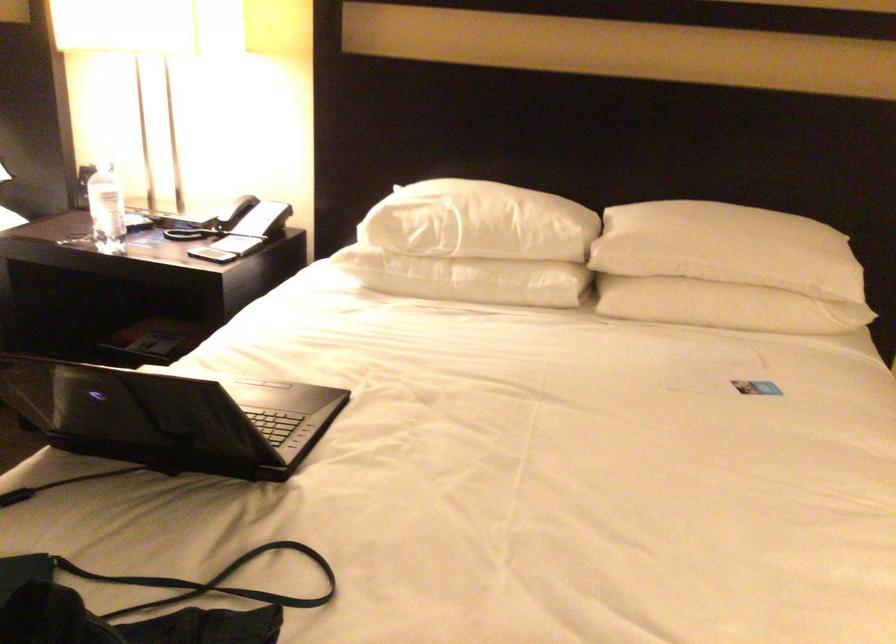
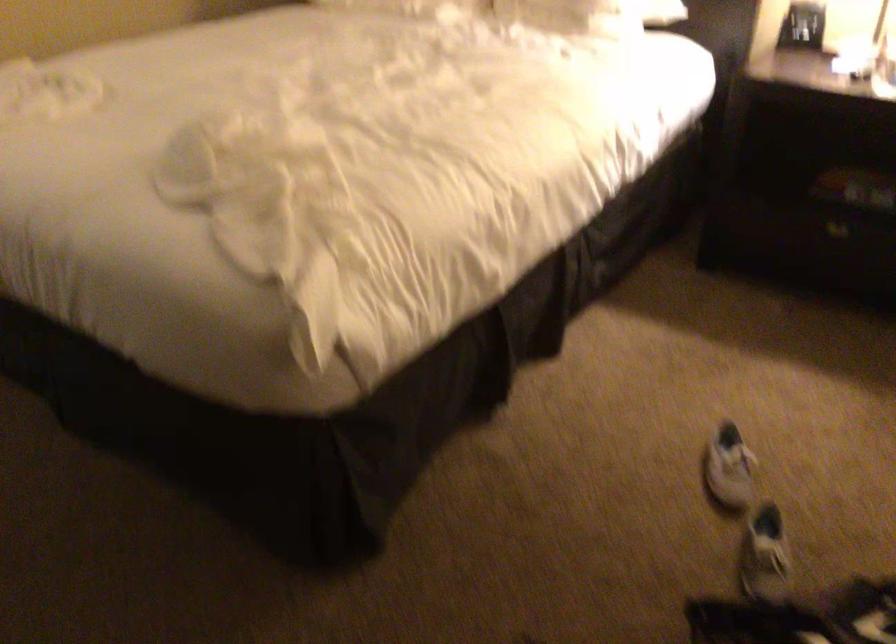
Question: What movement of the cameraman would produce the second image?

Choices:
 (A) Left
 (B) Right
 (C) Forward
 (D) Backward

Answer: (A)